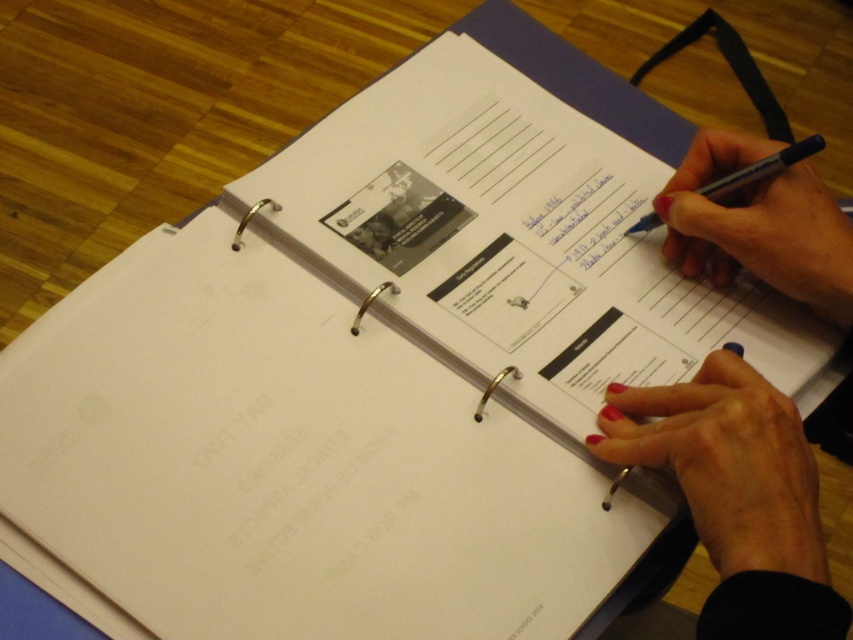
Between smooth skin hand at upper right and nail polish at lower right, which one appears on the left side from the viewer's perspective?

From the viewer's perspective, nail polish at lower right appears more on the left side.

What do you see at coordinates (735, 493) in the screenshot? I see `smooth skin hand at upper right` at bounding box center [735, 493].

Who is more forward, (740, 436) or (788, 449)?

Point (740, 436) is more forward.

Image resolution: width=853 pixels, height=640 pixels. I want to click on smooth skin hand at upper right, so pos(735,493).

Is nail polish at lower right below black pen at upper right?

Yes, nail polish at lower right is below black pen at upper right.

Looking at this image, who is lower down, nail polish at lower right or black pen at upper right?

nail polish at lower right is below.

Where is `nail polish at lower right`? The height and width of the screenshot is (640, 853). nail polish at lower right is located at coordinates (726, 464).

Is nail polish red hand at upper right above black pen at upper right?

No.

From the picture: Is nail polish red hand at upper right thinner than black pen at upper right?

No, nail polish red hand at upper right is not thinner than black pen at upper right.

Between point (688, 273) and point (656, 227), which one is positioned behind?

The point (656, 227) is more distant.

The width and height of the screenshot is (853, 640). I want to click on nail polish red hand at upper right, so click(758, 225).